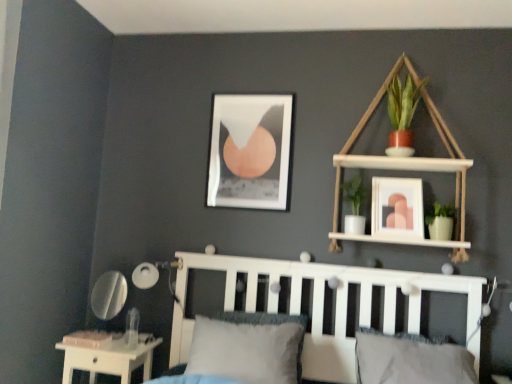
Image resolution: width=512 pixels, height=384 pixels. In order to click on vacant region above white glossy table at lower left (from a real-world perspective) in this screenshot , I will do `click(121, 339)`.